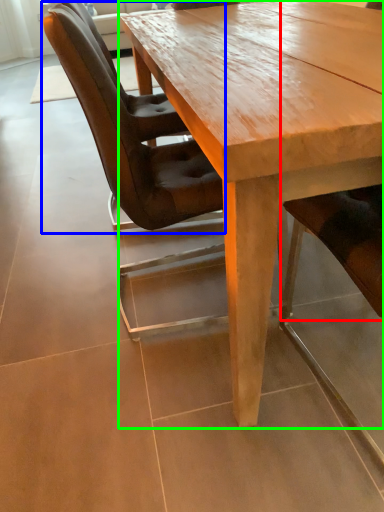
Question: Which object is positioned farthest from chair (highlighted by a red box)? Select from chair (highlighted by a blue box) and coffee table (highlighted by a green box).

Choices:
 (A) chair
 (B) coffee table

Answer: (A)